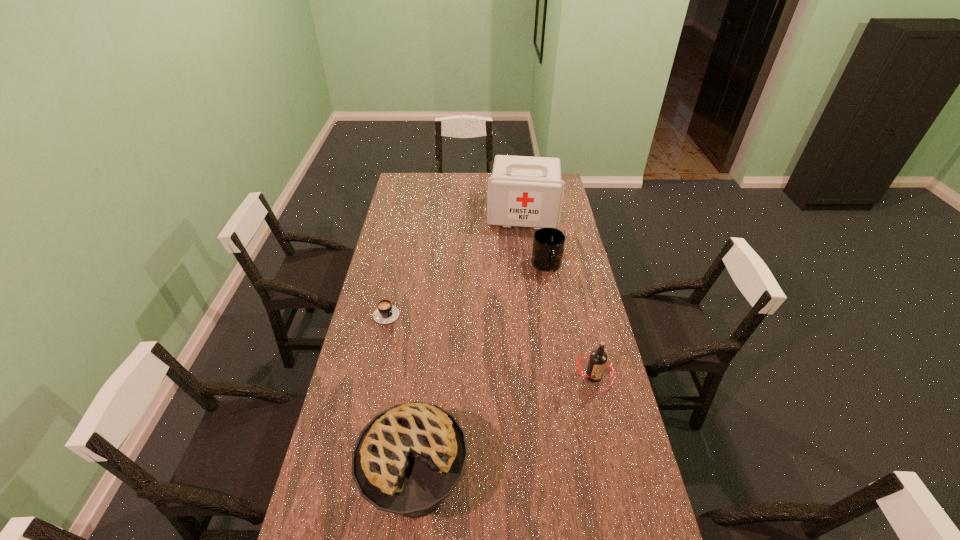
Find the location of a particular element. free space on the desktop that is between the nearest object and the root beer and is positioned with the handle on the side of the fourth nearest object is located at coordinates (531, 416).

Find the location of a particular element. The width and height of the screenshot is (960, 540). free space on the desktop that is between the nearest object and the second nearest object and is positioned on the front-facing side of the first-aid kit is located at coordinates (509, 430).

This screenshot has height=540, width=960. I want to click on free space on the desktop that is between the second tallest object and the third tallest object and is positioned with the handle on the side of the cappuccino, so click(x=503, y=434).